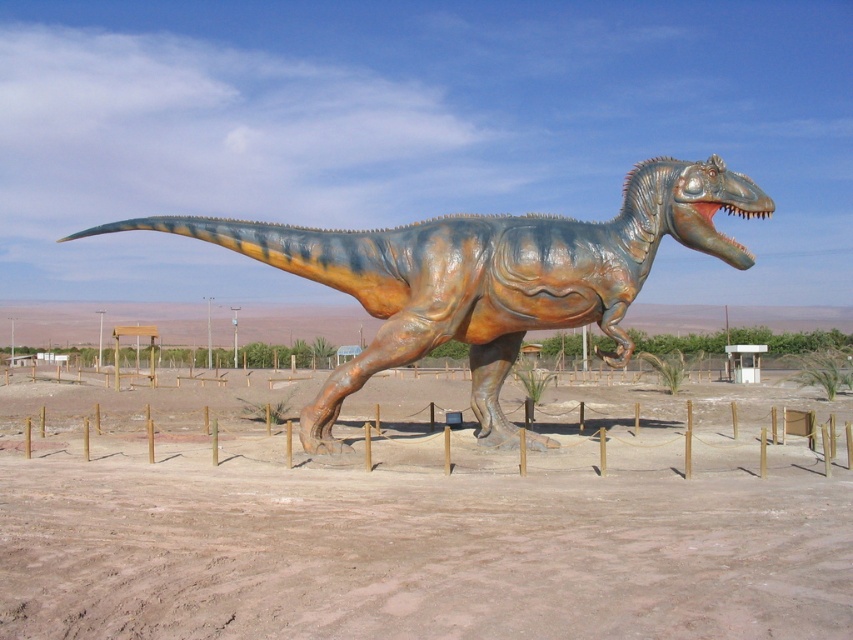
Looking at this image, you are a photographer planning to take a picture of the shiny bronze dinosaur at center. You want to ensure the brown sandy dirt at center is visible in the background. Based on their heights, will the dinosaur block the view of the sandy dirt?

The brown sandy dirt at center is not as tall as the shiny bronze dinosaur at center, so the dinosaur will block the view of the sandy dirt.

Based on the photo, you are a construction worker planning to place a new sculpture in the desert. The sculpture requires a base that must be wider than the existing shiny bronze dinosaur at center. Can the brown sandy dirt at center provide enough space for the sculpture base? Explain your reasoning.

The brown sandy dirt at center is thinner than the shiny bronze dinosaur at center, meaning it has a narrower width. Since the required base needs to be wider than the dinosaur, the sandy dirt area may not provide sufficient space. Choose a location with wider ground area.

In the scene shown: You are standing in front of the shiny bronze dinosaur at center and want to place a small flag on the brown sandy dirt at center. Can you place the flag directly in front of the dinosaur without stepping on the dirt?

The brown sandy dirt at center is closer to the viewer than the shiny bronze dinosaur at center, so placing the flag directly in front of the dinosaur would require placing it on the dirt, meaning you would be stepping on the dirt to do so.